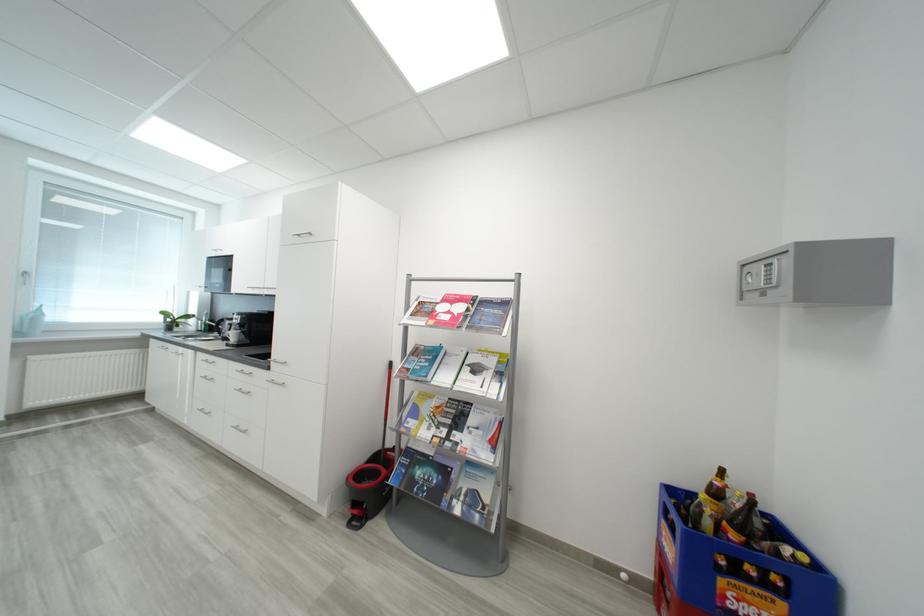
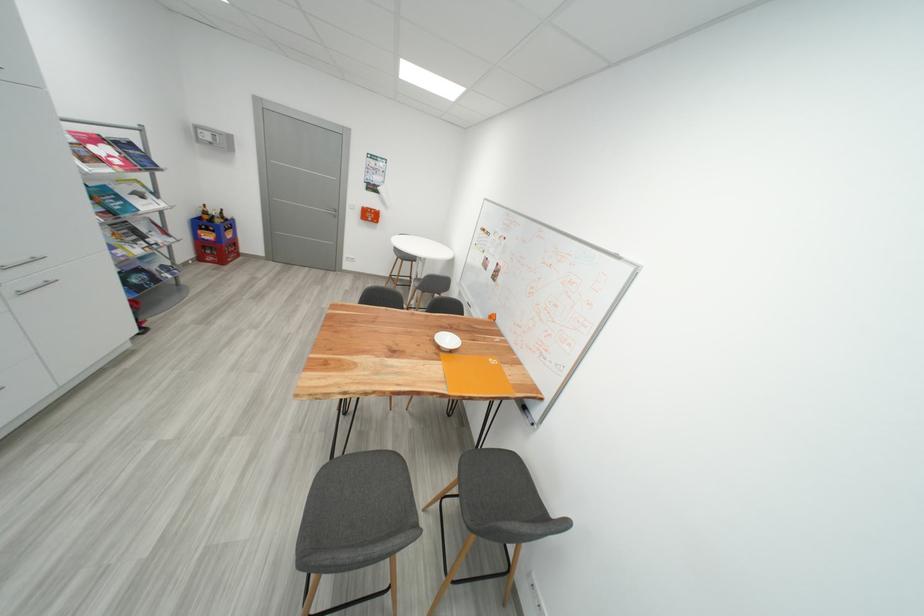
Find the pixel in the second image that matches point (434, 362) in the first image.

(122, 201)